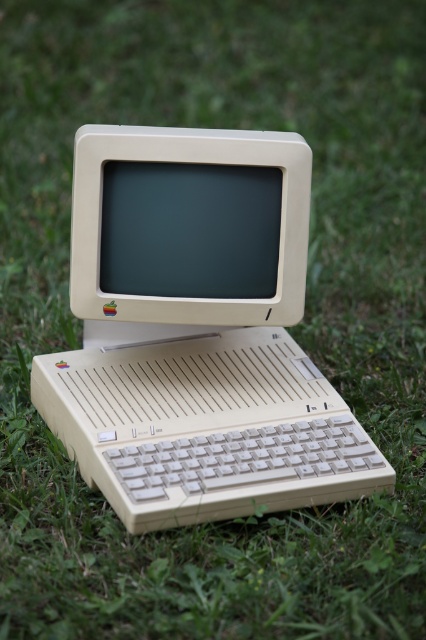
Does point (282, 344) lie in front of point (204, 262)?

No, it is behind (204, 262).

Is point (226, 189) farther from camera compared to point (103, 209)?

Yes, point (226, 189) is farther from viewer.

Who is more distant from viewer, (163, 170) or (152, 132)?

The point (163, 170) is behind.

Where is `beige plastic computer at center`? This screenshot has width=426, height=640. beige plastic computer at center is located at coordinates (195, 332).